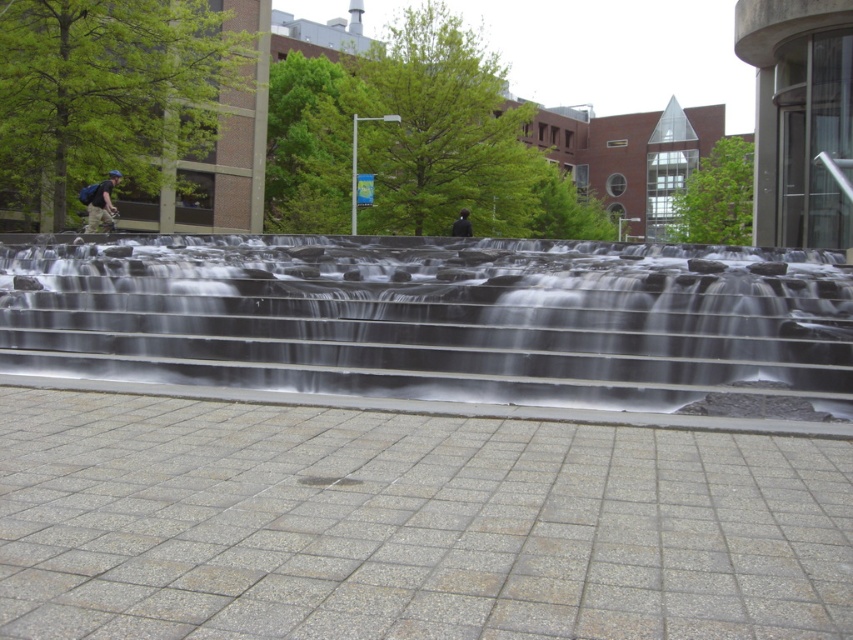
Question: Is clear glass water at center to the right of dark blue fabric jacket at center from the viewer's perspective?

Choices:
 (A) yes
 (B) no

Answer: (B)

Question: Which point appears closest to the camera in this image?

Choices:
 (A) (451, 236)
 (B) (489, 301)

Answer: (B)

Question: Can you confirm if clear glass water at center is positioned below matte black backpack at left?

Choices:
 (A) no
 (B) yes

Answer: (B)

Question: Does matte black backpack at left have a greater width compared to dark blue fabric jacket at center?

Choices:
 (A) yes
 (B) no

Answer: (B)

Question: Among these objects, which one is nearest to the camera?

Choices:
 (A) clear glass water at center
 (B) dark blue fabric jacket at center
 (C) matte black backpack at left

Answer: (A)

Question: Which object appears closest to the camera in this image?

Choices:
 (A) clear glass water at center
 (B) matte black backpack at left
 (C) dark blue fabric jacket at center

Answer: (A)